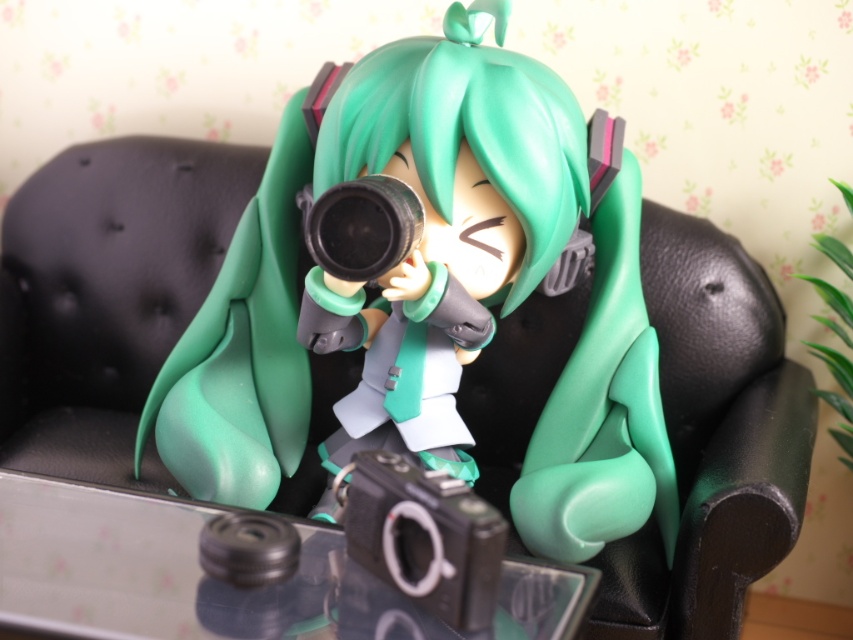
How distant is matte green figure at center from black plastic lens at center?

The distance of matte green figure at center from black plastic lens at center is 9.40 inches.

Is point (402, 358) closer to viewer compared to point (370, 244)?

No, it is not.

This screenshot has width=853, height=640. I want to click on matte green figure at center, so click(431, 298).

This screenshot has height=640, width=853. What are the coordinates of `matte green figure at center` in the screenshot? It's located at (431, 298).

Between transparent glass camera at lower center and black plastic lens at center, which one has more height?

With more height is black plastic lens at center.

Measure the distance between transparent glass camera at lower center and black plastic lens at center.

transparent glass camera at lower center and black plastic lens at center are 17.26 inches apart from each other.

Who is more distant from viewer, [107,492] or [363,236]?

Positioned behind is point [363,236].

The width and height of the screenshot is (853, 640). What are the coordinates of `transparent glass camera at lower center` in the screenshot? It's located at (219, 580).

Who is more forward, (503, 611) or (262, 516)?

Point (503, 611) is more forward.

Who is more distant from viewer, (x=61, y=508) or (x=198, y=548)?

The point (x=61, y=508) is behind.

Where is `transparent glass camera at lower center`? This screenshot has width=853, height=640. transparent glass camera at lower center is located at coordinates (219, 580).